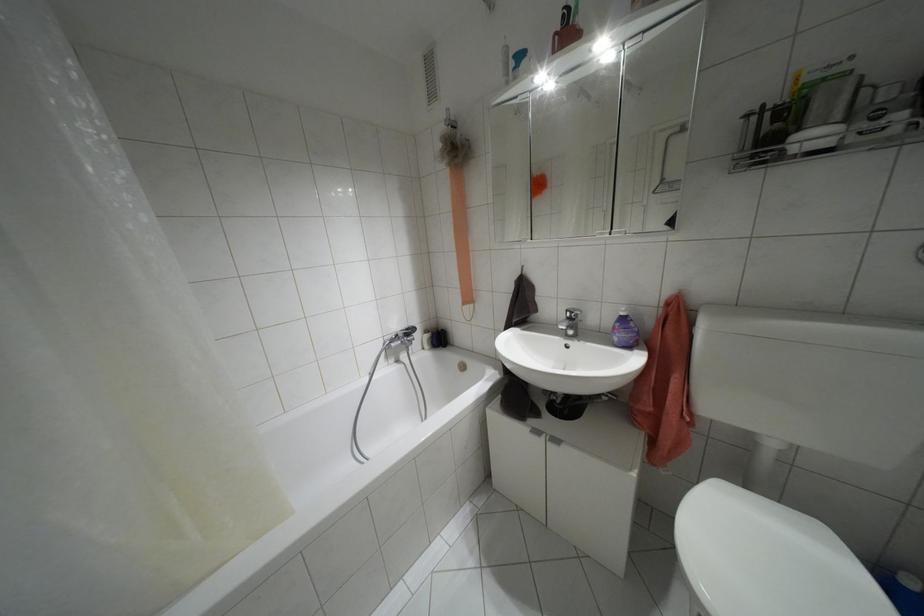
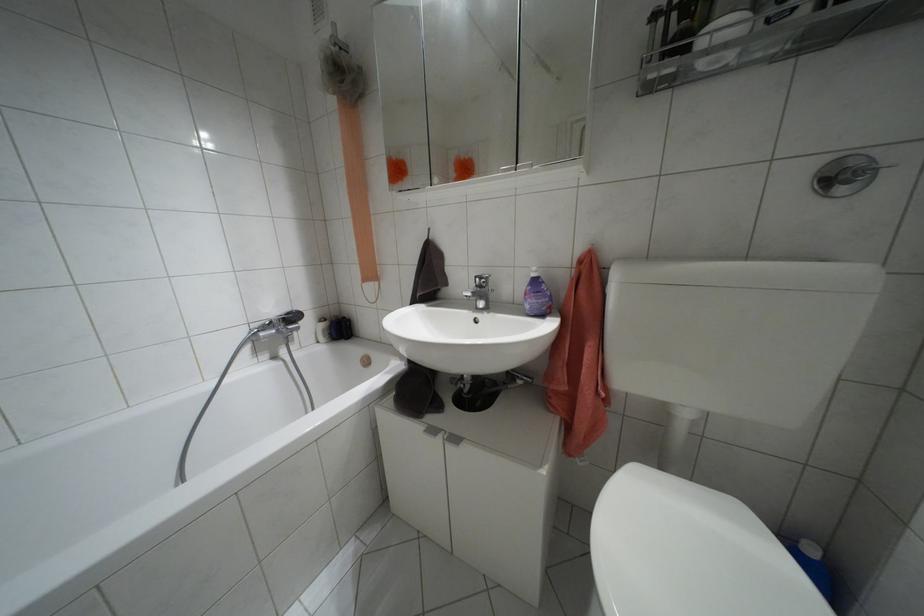
In the second image, find the point that corresponds to point (622, 313) in the first image.

(532, 274)